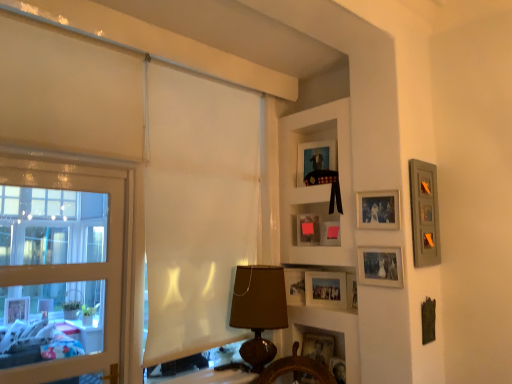
What is the approximate width of wooden picture frame at lower center, which appears as the 9th picture frame when viewed from the top?

wooden picture frame at lower center, which appears as the 9th picture frame when viewed from the top, is 3.58 inches wide.

Describe the element at coordinates (326, 289) in the screenshot. I see `matte silver picture frame at center, which is counted as the 3th picture frame, starting from the bottom` at that location.

Describe the element at coordinates (378, 210) in the screenshot. The height and width of the screenshot is (384, 512). I see `matte silver photo frame at upper right, which is the second picture frame from top to bottom` at that location.

The width and height of the screenshot is (512, 384). Describe the element at coordinates (316, 187) in the screenshot. I see `wooden shelf at upper center, positioned as the first shelf in top-to-bottom order` at that location.

I want to click on matte silver picture frame at center-right, the 4th picture frame from the bottom, so click(x=380, y=266).

At what (x,y) coordinates should I click in order to perform the action: click on wooden picture frame at lower center, which appears as the 9th picture frame when viewed from the top. Please return your answer as a coordinate pair (x, y). The image size is (512, 384). Looking at the image, I should click on coord(338,369).

Between wooden picture frame at lower center, the eighth picture frame positioned from the top, and wooden picture frame at right, which ranks as the 7th picture frame in bottom-to-top order, which one has smaller size?

wooden picture frame at right, which ranks as the 7th picture frame in bottom-to-top order, is smaller.

How much distance is there between wooden picture frame at lower center, arranged as the second picture frame when ordered from the bottom, and wooden picture frame at right, which is counted as the 3th picture frame, starting from the top?

wooden picture frame at lower center, arranged as the second picture frame when ordered from the bottom, and wooden picture frame at right, which is counted as the 3th picture frame, starting from the top, are 38.63 inches apart from each other.

Which is closer, (325,335) or (413,254)?

Point (413,254)

Based on the photo, does wooden picture frame at lower center, the eighth picture frame positioned from the top, appear on the right side of wooden picture frame at right, which ranks as the 7th picture frame in bottom-to-top order?

Incorrect, wooden picture frame at lower center, the eighth picture frame positioned from the top, is not on the right side of wooden picture frame at right, which ranks as the 7th picture frame in bottom-to-top order.

Is matte black picture frame at upper center, the ninth picture frame ordered from the bottom, smaller than wooden picture frame at lower center, the first picture frame when ordered from bottom to top?

No.

Is matte black picture frame at upper center, arranged as the 1th picture frame when viewed from the top, at the right side of wooden picture frame at lower center, the first picture frame when ordered from bottom to top?

No, matte black picture frame at upper center, arranged as the 1th picture frame when viewed from the top, is not to the right of wooden picture frame at lower center, the first picture frame when ordered from bottom to top.

Is matte black picture frame at upper center, arranged as the 1th picture frame when viewed from the top, in contact with wooden picture frame at lower center, the first picture frame when ordered from bottom to top?

No, matte black picture frame at upper center, arranged as the 1th picture frame when viewed from the top, is not making contact with wooden picture frame at lower center, the first picture frame when ordered from bottom to top.

From the image's perspective, is matte black picture frame at upper center, arranged as the 1th picture frame when viewed from the top, located above or below wooden picture frame at lower center, the first picture frame when ordered from bottom to top?

From the image's perspective, matte black picture frame at upper center, arranged as the 1th picture frame when viewed from the top, appears above wooden picture frame at lower center, the first picture frame when ordered from bottom to top.

In terms of width, does wooden picture frame at lower center, the eighth picture frame positioned from the top, look wider or thinner when compared to matte black picture frame at upper center, the ninth picture frame ordered from the bottom?

Considering their sizes, wooden picture frame at lower center, the eighth picture frame positioned from the top, looks broader than matte black picture frame at upper center, the ninth picture frame ordered from the bottom.

Is wooden picture frame at lower center, the eighth picture frame positioned from the top, positioned with its back to matte black picture frame at upper center, arranged as the 1th picture frame when viewed from the top?

No, wooden picture frame at lower center, the eighth picture frame positioned from the top, is not facing the opposite direction of matte black picture frame at upper center, arranged as the 1th picture frame when viewed from the top.

Who is more distant, wooden picture frame at lower center, arranged as the second picture frame when ordered from the bottom, or matte black picture frame at upper center, the ninth picture frame ordered from the bottom?

matte black picture frame at upper center, the ninth picture frame ordered from the bottom, is behind.

Does matte silver picture frame at center-right, the 4th picture frame from the bottom, have a greater height compared to white sheer curtain at center?

No, matte silver picture frame at center-right, the 4th picture frame from the bottom, is not taller than white sheer curtain at center.

From a real-world perspective, between matte silver picture frame at center-right, the 4th picture frame from the bottom, and white sheer curtain at center, who is vertically lower?

matte silver picture frame at center-right, the 4th picture frame from the bottom.

Is matte silver picture frame at center-right, the 4th picture frame from the bottom, oriented towards white sheer curtain at center?

No, matte silver picture frame at center-right, the 4th picture frame from the bottom, does not turn towards white sheer curtain at center.

Which point is more forward, (393, 254) or (226, 135)?

The point (393, 254) is closer.

From the picture: Can you confirm if wooden picture frame at right, which ranks as the 7th picture frame in bottom-to-top order, is bigger than matte pink picture frame at center, placed as the sixth picture frame when sorted from bottom to top?

Yes, wooden picture frame at right, which ranks as the 7th picture frame in bottom-to-top order, is bigger than matte pink picture frame at center, placed as the sixth picture frame when sorted from bottom to top.

From the image's perspective, which one is positioned lower, wooden picture frame at right, which is counted as the 3th picture frame, starting from the top, or matte pink picture frame at center, placed as the sixth picture frame when sorted from bottom to top?

matte pink picture frame at center, placed as the sixth picture frame when sorted from bottom to top.

From a real-world perspective, is wooden picture frame at right, which ranks as the 7th picture frame in bottom-to-top order, below matte pink picture frame at center, the fourth picture frame viewed from the top?

No, from a real-world perspective, wooden picture frame at right, which ranks as the 7th picture frame in bottom-to-top order, is not below matte pink picture frame at center, the fourth picture frame viewed from the top.

Is point (338, 367) farther from viewer compared to point (316, 294)?

No, (338, 367) is in front of (316, 294).

Is matte silver picture frame at center, which is counted as the 3th picture frame, starting from the bottom, a part of wooden picture frame at lower center, the first picture frame when ordered from bottom to top?

Definitely not — matte silver picture frame at center, which is counted as the 3th picture frame, starting from the bottom, is not inside wooden picture frame at lower center, the first picture frame when ordered from bottom to top.

Can you confirm if wooden picture frame at lower center, the first picture frame when ordered from bottom to top, is smaller than matte silver picture frame at center, which is counted as the 3th picture frame, starting from the bottom?

Correct, wooden picture frame at lower center, the first picture frame when ordered from bottom to top, occupies less space than matte silver picture frame at center, which is counted as the 3th picture frame, starting from the bottom.

Between wooden picture frame at lower center, which appears as the 9th picture frame when viewed from the top, and matte silver picture frame at center, which is counted as the 3th picture frame, starting from the bottom, which one has smaller width?

With smaller width is matte silver picture frame at center, which is counted as the 3th picture frame, starting from the bottom.

In the scene shown: Is there a large distance between wooden ship's wheel at lower center, acting as the first shelf starting from the bottom, and wooden picture frame at lower center, the eighth picture frame positioned from the top?

Actually, wooden ship's wheel at lower center, acting as the first shelf starting from the bottom, and wooden picture frame at lower center, the eighth picture frame positioned from the top, are a little close together.

From the image's perspective, is wooden ship's wheel at lower center, acting as the first shelf starting from the bottom, over wooden picture frame at lower center, the eighth picture frame positioned from the top?

Indeed, from the image's perspective, wooden ship's wheel at lower center, acting as the first shelf starting from the bottom, is shown above wooden picture frame at lower center, the eighth picture frame positioned from the top.

Does point (347, 379) appear closer or farther from the camera than point (305, 345)?

Point (347, 379) appears to be closer to the viewer than point (305, 345).

From a real-world perspective, which picture frame is the 5th one above the wooden picture frame at lower center, arranged as the second picture frame when ordered from the bottom? Please provide its 2D coordinates.

[(424, 213)]

Which picture frame is the 5th one when counting from the front of the matte black picture frame at upper center, the ninth picture frame ordered from the bottom? Please provide its 2D coordinates.

[(338, 369)]

Based on their spatial positions, is wooden shelf at upper center, positioned as the first shelf in top-to-bottom order, or wooden picture frame at right, which is counted as the 3th picture frame, starting from the top, further from white sheer curtain at center?

Among the two, wooden picture frame at right, which is counted as the 3th picture frame, starting from the top, is located further to white sheer curtain at center.

Based on their spatial positions, is brown fabric lampshade at center or matte silver picture frame at center-right, which appears as the 6th picture frame when viewed from the top, closer to matte black picture frame at upper center, arranged as the 1th picture frame when viewed from the top?

matte silver picture frame at center-right, which appears as the 6th picture frame when viewed from the top.

Based on their spatial positions, is matte black picture frame at upper center, the ninth picture frame ordered from the bottom, or wooden picture frame at lower center, which appears as the 9th picture frame when viewed from the top, closer to wooden ship's wheel at lower center, the second shelf positioned from the top?

The object closer to wooden ship's wheel at lower center, the second shelf positioned from the top, is wooden picture frame at lower center, which appears as the 9th picture frame when viewed from the top.

When comparing their distances from matte pink picture frame at center, the 5th picture frame from the top, does brown fabric lampshade at center or matte pink picture frame at center, the fourth picture frame viewed from the top, seem closer?

Among the two, matte pink picture frame at center, the fourth picture frame viewed from the top, is located nearer to matte pink picture frame at center, the 5th picture frame from the top.

From the image, which object appears to be nearer to wooden frame window at left, wooden picture frame at lower center, which appears as the 9th picture frame when viewed from the top, or brown fabric lampshade at center?

Based on the image, brown fabric lampshade at center appears to be nearer to wooden frame window at left.

Based on their spatial positions, is wooden picture frame at right, which is counted as the 3th picture frame, starting from the top, or white sheer curtain at center further from matte silver picture frame at center, which is counted as the seventh picture frame, starting from the top?

white sheer curtain at center lies further to matte silver picture frame at center, which is counted as the seventh picture frame, starting from the top, than the other object.

Estimate the real-world distances between objects in this image. Which object is closer to wooden picture frame at lower center, arranged as the second picture frame when ordered from the bottom, matte pink picture frame at center, the fourth picture frame viewed from the top, or wooden ship's wheel at lower center, acting as the first shelf starting from the bottom?

wooden ship's wheel at lower center, acting as the first shelf starting from the bottom, is positioned closer to the anchor wooden picture frame at lower center, arranged as the second picture frame when ordered from the bottom.

Looking at this image, based on their spatial positions, is matte pink picture frame at center, the fourth picture frame viewed from the top, or wooden picture frame at lower center, the eighth picture frame positioned from the top, closer to wooden picture frame at right, which ranks as the 7th picture frame in bottom-to-top order?

matte pink picture frame at center, the fourth picture frame viewed from the top, is positioned closer to the anchor wooden picture frame at right, which ranks as the 7th picture frame in bottom-to-top order.

Identify the location of table lamp located between wooden frame window at left and matte silver picture frame at center-right, which appears as the 6th picture frame when viewed from the top, in the left-right direction. (258, 310).

Where is `table lamp between matte black picture frame at upper center, the ninth picture frame ordered from the bottom, and wooden picture frame at lower center, which appears as the 9th picture frame when viewed from the top, from top to bottom`? The height and width of the screenshot is (384, 512). table lamp between matte black picture frame at upper center, the ninth picture frame ordered from the bottom, and wooden picture frame at lower center, which appears as the 9th picture frame when viewed from the top, from top to bottom is located at coordinates (258, 310).

Where is `table lamp between wooden shelf at upper center, positioned as the second shelf in bottom-to-top order, and wooden ship's wheel at lower center, acting as the first shelf starting from the bottom, in the vertical direction`? The height and width of the screenshot is (384, 512). table lamp between wooden shelf at upper center, positioned as the second shelf in bottom-to-top order, and wooden ship's wheel at lower center, acting as the first shelf starting from the bottom, in the vertical direction is located at coordinates (258, 310).

Find the location of a particular element. curtain situated between wooden frame window at left and wooden picture frame at right, which is counted as the 3th picture frame, starting from the top, from left to right is located at coordinates (197, 209).